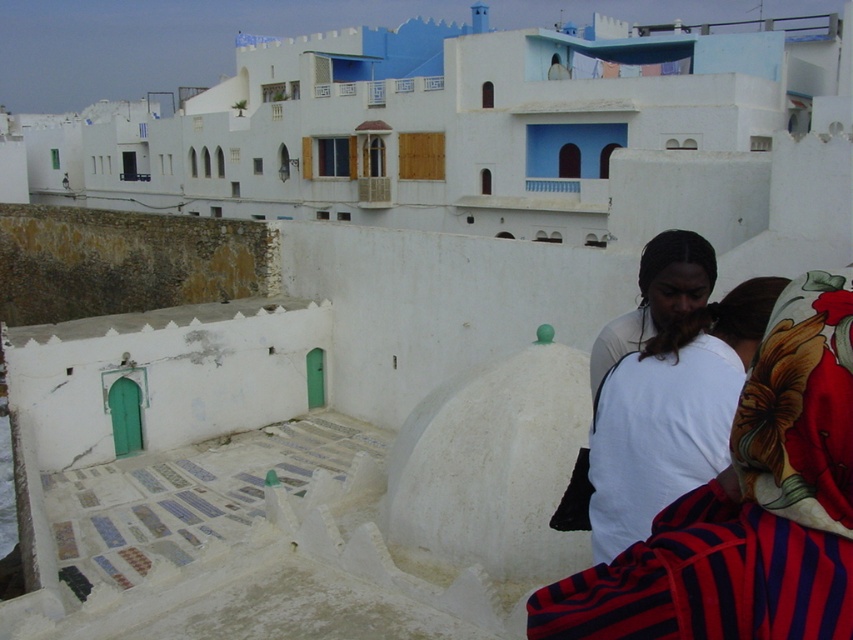
Does floral fabric headscarf at right have a greater height compared to white cotton shirt at right?

No, floral fabric headscarf at right is not taller than white cotton shirt at right.

From the picture: Who is more forward, (738, 518) or (645, 461)?

Point (738, 518)

This screenshot has height=640, width=853. What are the coordinates of `floral fabric headscarf at right` in the screenshot? It's located at (746, 506).